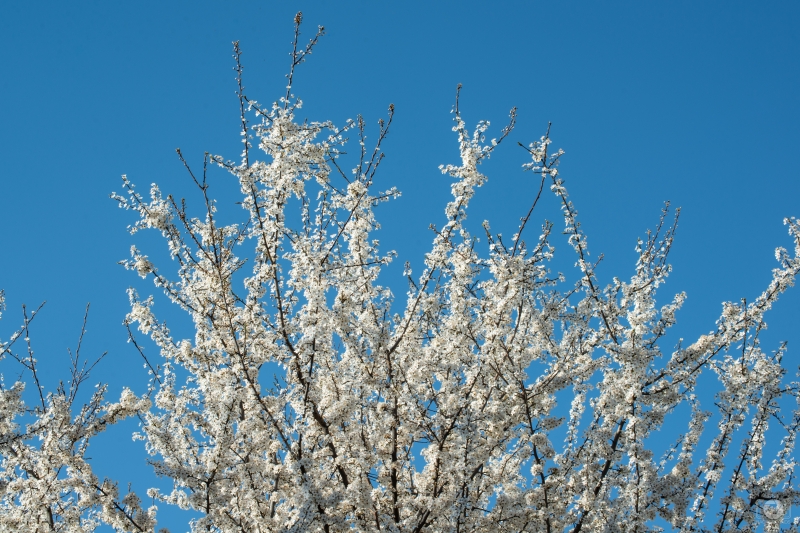
Locate an element on the screen. The image size is (800, 533). plant is located at coordinates (376, 467).